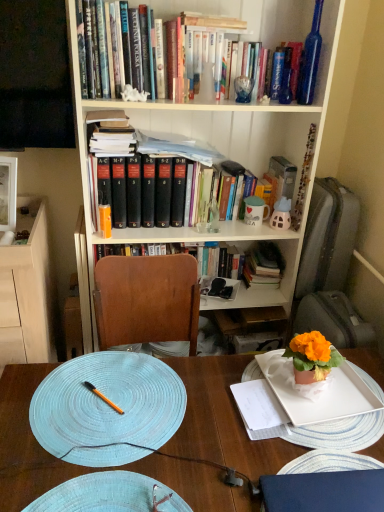
Where is `vacant space positioned to the left of white paper notebook at center`? The image size is (384, 512). vacant space positioned to the left of white paper notebook at center is located at coordinates (192, 411).